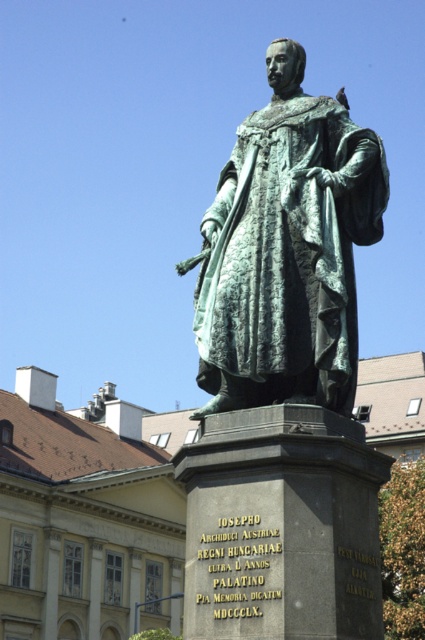
Question: Which of the following is the farthest from the observer?

Choices:
 (A) green patina statue at center
 (B) green patina bronze statue at center

Answer: (A)

Question: Is green patina statue at center bigger than green patina bronze statue at center?

Choices:
 (A) yes
 (B) no

Answer: (A)

Question: Considering the relative positions of green patina statue at center and green patina bronze statue at center in the image provided, where is green patina statue at center located with respect to green patina bronze statue at center?

Choices:
 (A) right
 (B) left

Answer: (B)

Question: Is green patina statue at center positioned at the back of green patina bronze statue at center?

Choices:
 (A) no
 (B) yes

Answer: (B)

Question: Which of the following is the farthest from the observer?

Choices:
 (A) (5, 400)
 (B) (241, 250)

Answer: (A)

Question: Which of the following is the farthest from the observer?

Choices:
 (A) green patina statue at center
 (B) green patina bronze statue at center

Answer: (A)